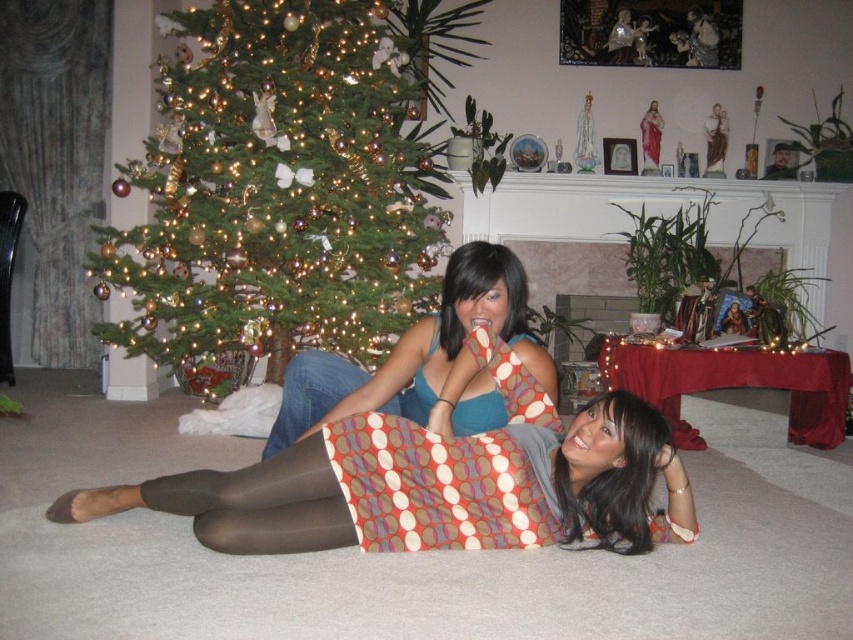
Question: Does shiny gold ornaments at left have a greater width compared to polka dot skirt at center?

Choices:
 (A) yes
 (B) no

Answer: (B)

Question: Among these points, which one is nearest to the camera?

Choices:
 (A) (526, 337)
 (B) (294, 397)

Answer: (A)

Question: Which of the following is the closest to the observer?

Choices:
 (A) (346, 273)
 (B) (479, 419)

Answer: (B)

Question: Which of these objects is positioned farthest from the matte blue tank top at center?

Choices:
 (A) shiny gold ornaments at left
 (B) polka dot fabric at center
 (C) polka dot skirt at center

Answer: (A)

Question: Can you confirm if shiny gold ornaments at left is smaller than polka dot fabric at center?

Choices:
 (A) no
 (B) yes

Answer: (A)

Question: Is shiny gold ornaments at left thinner than polka dot skirt at center?

Choices:
 (A) yes
 (B) no

Answer: (A)